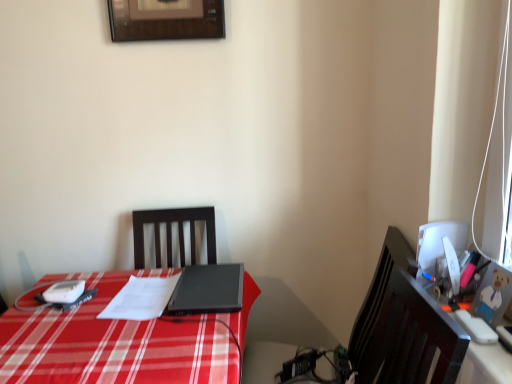
The width and height of the screenshot is (512, 384). Find the location of `blank space above orange plastic toy at right (from a real-world perspective)`. blank space above orange plastic toy at right (from a real-world perspective) is located at coordinates (473, 320).